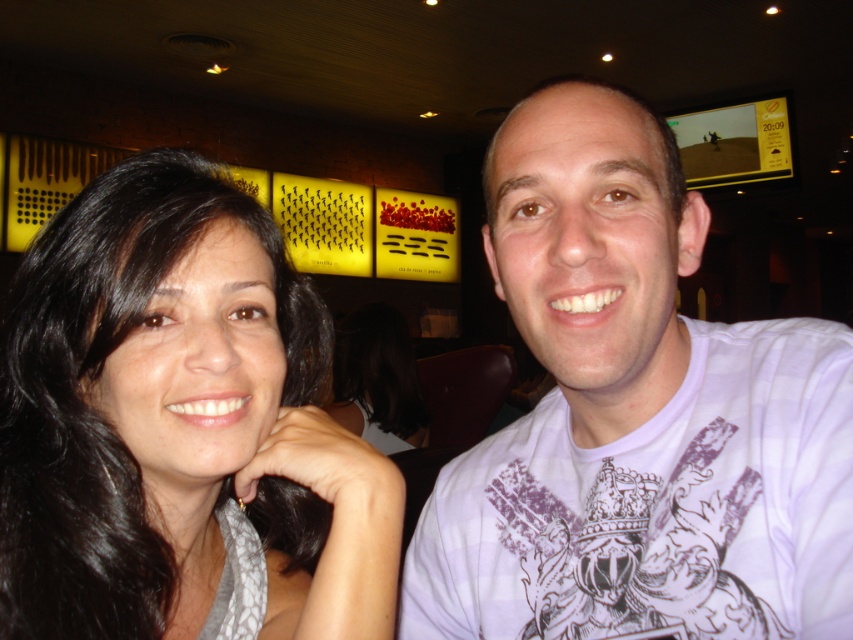
Question: Is white printed t-shirt at center bigger than black hair at left?

Choices:
 (A) no
 (B) yes

Answer: (B)

Question: Which of the following is the farthest from the observer?

Choices:
 (A) (833, 561)
 (B) (279, 595)

Answer: (B)

Question: Among these objects, which one is nearest to the camera?

Choices:
 (A) black hair at left
 (B) white printed t-shirt at center

Answer: (A)

Question: Does white printed t-shirt at center lie in front of black hair at left?

Choices:
 (A) yes
 (B) no

Answer: (B)

Question: Which point appears farthest from the camera in this image?

Choices:
 (A) (801, 323)
 (B) (113, 365)

Answer: (A)

Question: Is white printed t-shirt at center below black hair at left?

Choices:
 (A) yes
 (B) no

Answer: (A)